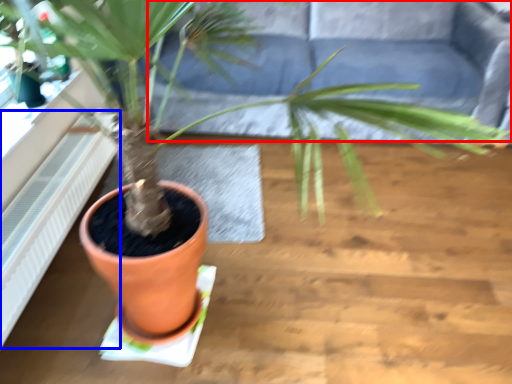
Question: Which of the following is the closest to the observer, couch (highlighted by a red box) or radiator (highlighted by a blue box)?

Choices:
 (A) couch
 (B) radiator

Answer: (B)